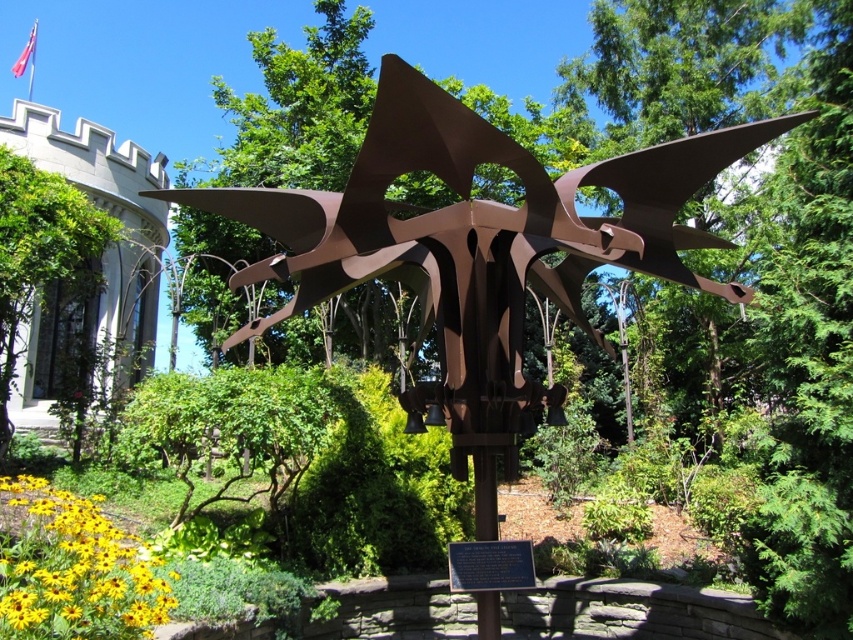
Which is more to the right, rusty metal sculpture at center or green leafy tree at left?

Positioned to the right is rusty metal sculpture at center.

Which is above, rusty metal sculpture at center or green leafy tree at left?

green leafy tree at left is higher up.

You are a GUI agent. You are given a task and a screenshot of the screen. Output one action in this format:
    pyautogui.click(x=<x>, y=<y>)
    Task: Click on the rusty metal sculpture at center
    
    Given the screenshot: What is the action you would take?
    pyautogui.click(x=479, y=252)

Locate an element on the screen. rusty metal sculpture at center is located at coordinates (479, 252).